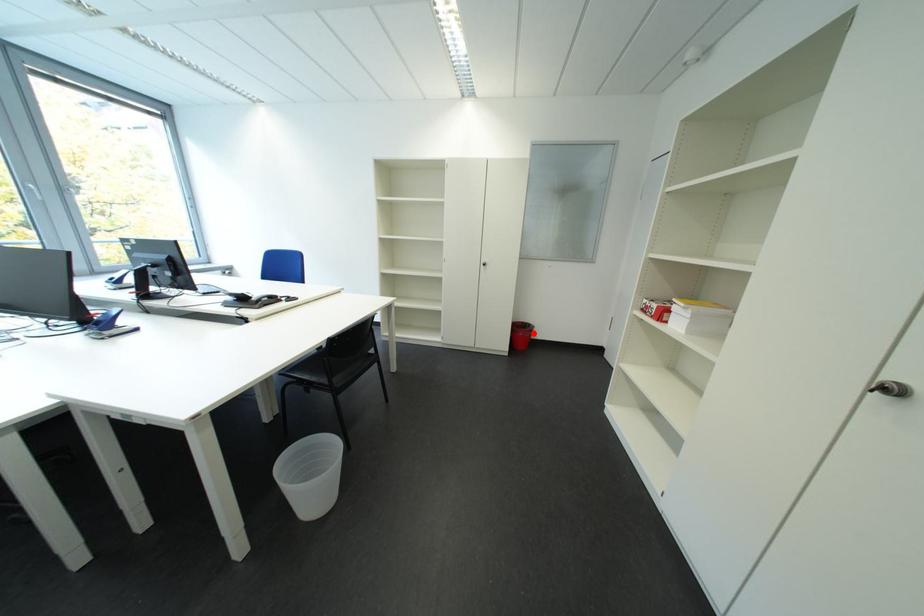
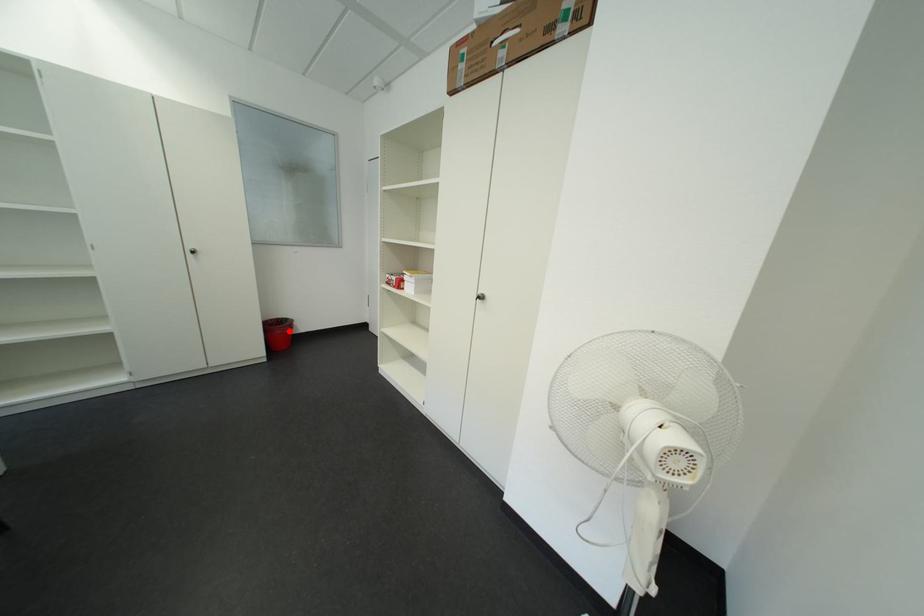
I am providing you with two images of the same scene from different viewpoints. A red point is marked on the first image and another point is marked on the second image. Is the marked point in image1 the same physical position as the marked point in image2?

Yes